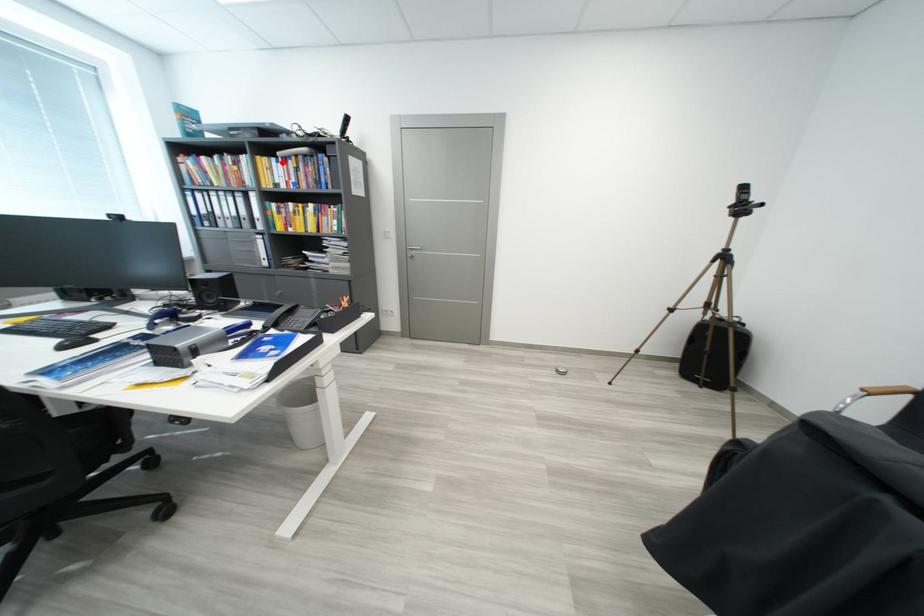
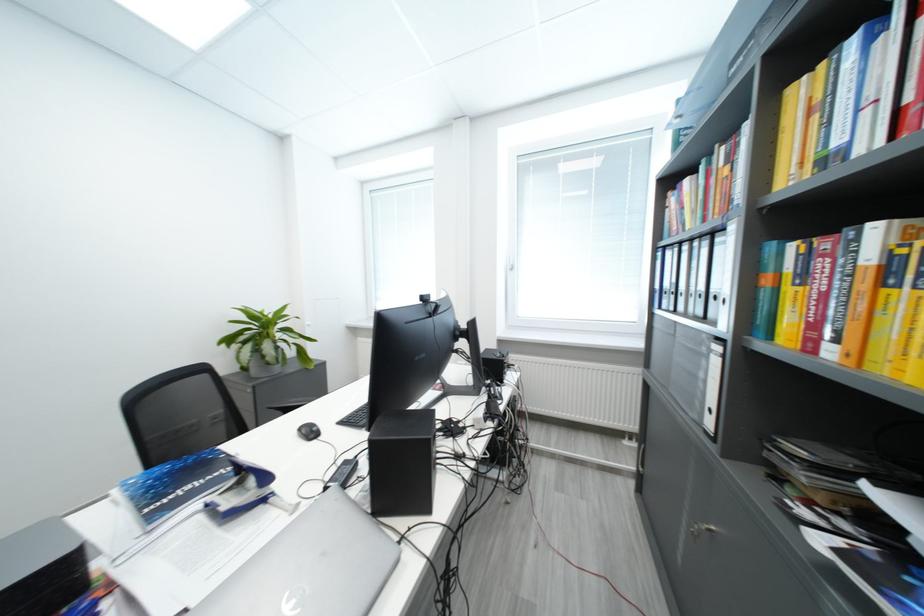
Where in the second image is the point corresponding to the highlighted location from the first image?

(861, 44)